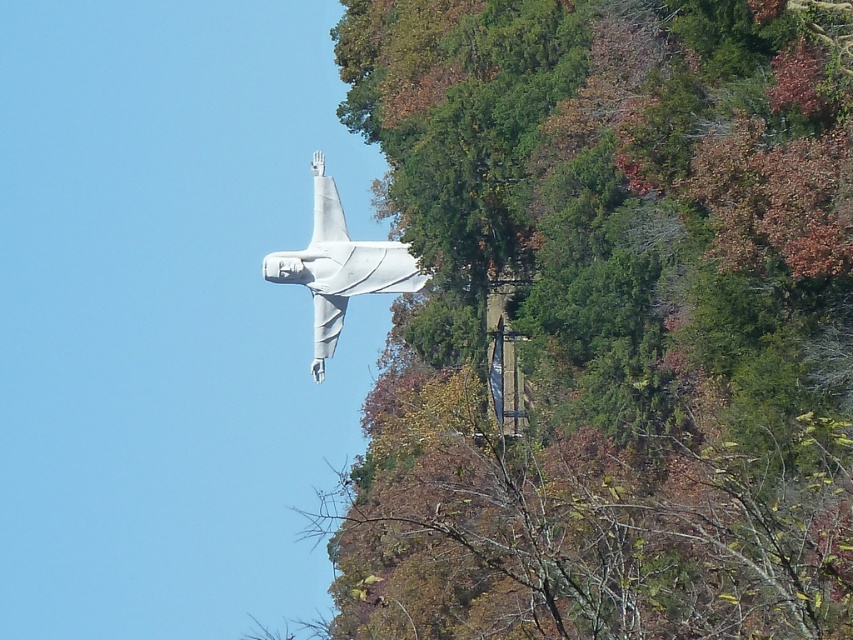
You are a photographer planning to take a photo of the white matte statue at center and the green leafy tree at upper center. You need to ensure that both subjects are in focus. If your camera has a depth of field range of 15 meters, will both subjects be in focus?

The green leafy tree at upper center is 18.19 meters from the white matte statue at center. Since the distance between them exceeds the camera depth of field range of 15 meters, the two subjects cannot both be in focus at the same time.

You are standing at point (721, 288) and want to reach the statue of Jesus Christ. The statue is 152.06 meters away from your current position. If you have a drone that can fly up to 150 meters, can it reach the statue from your current location?

The distance between point (721, 288) and the statue of Jesus Christ is 152.06 meters. Since the drone can only fly up to 150 meters, it cannot reach the statue from your current location.